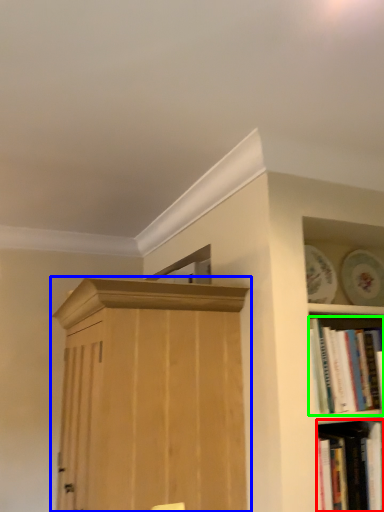
Question: Considering the real-world distances, which object is farthest from book (highlighted by a red box)? cupboard (highlighted by a blue box) or book (highlighted by a green box)?

Choices:
 (A) cupboard
 (B) book

Answer: (A)